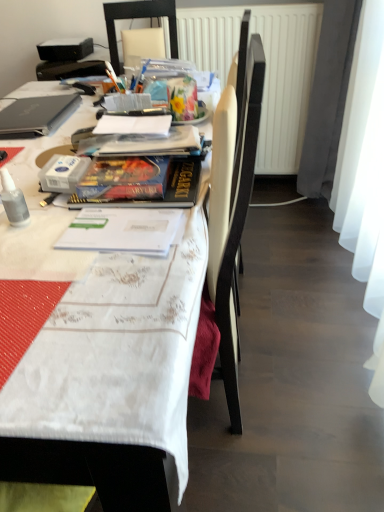
In order to click on unoccupied space behind transparent plastic bottle at left in this screenshot , I will do `click(34, 191)`.